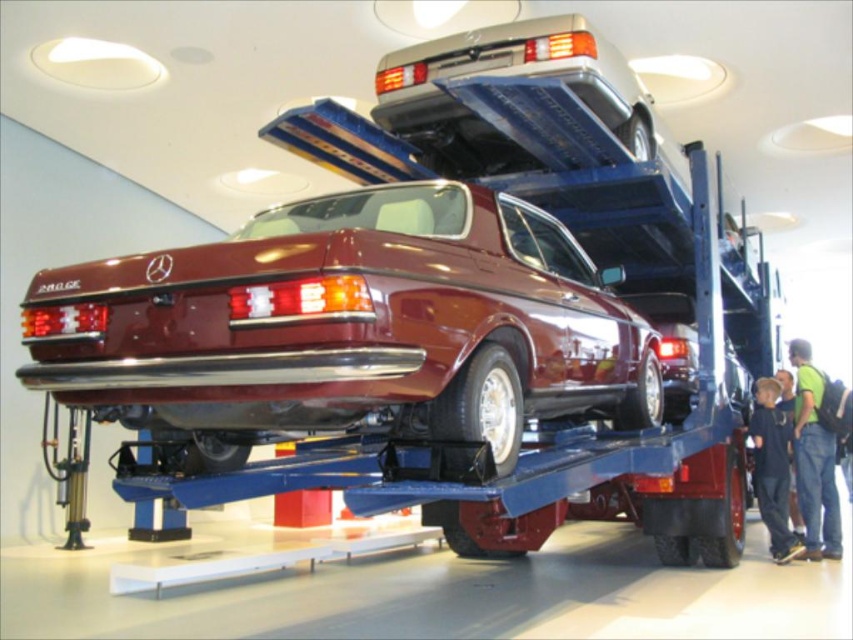
Please provide the exact coordinates of the shiny maroon car at center in the image. The coordinates should be in the format of two decimal numbers separated by a comma, like 0.5,0.5.

The shiny maroon car at center is located at coordinates (349,326).

You are a photographer setting up a shoot in the showroom. You need to decide whether the shiny maroon car at center will fit through a doorway that is the same width as the green fabric shirt at lower right. Can you confirm if the car will fit?

The shiny maroon car at center is wider than the green fabric shirt at lower right, so it will not fit through a doorway of the shirt width.

You are an event planner setting up a car exhibition. You need to ensure that the shiny maroon car at center and the green fabric shirt at lower right are visible to all attendees. Based on their heights, which object might require a platform to be seen better?

The shiny maroon car at center has a lesser height compared to green fabric shirt at lower right, so the car might require a platform to be seen better.